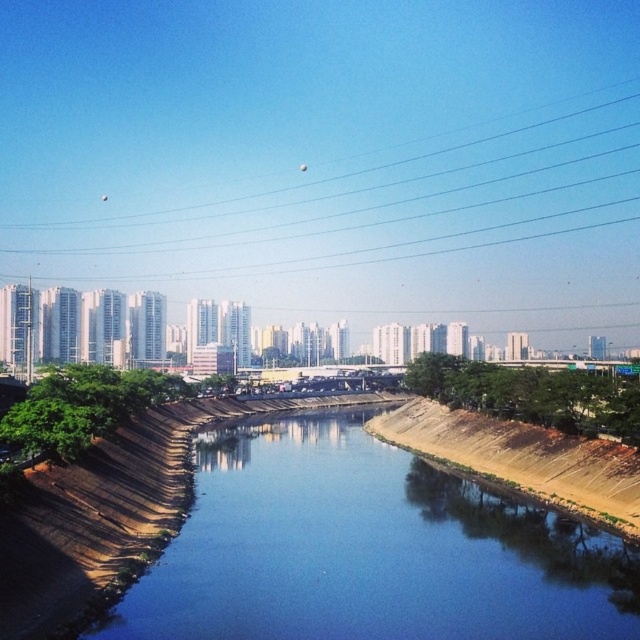
Is blue smooth water at center bigger than transparent glass power lines at upper center?

Actually, blue smooth water at center might be smaller than transparent glass power lines at upper center.

Does blue smooth water at center lie behind transparent glass power lines at upper center?

No, blue smooth water at center is in front of transparent glass power lines at upper center.

Who is more forward, (513,621) or (556,116)?

Positioned in front is point (513,621).

What are the coordinates of `blue smooth water at center` in the screenshot? It's located at coord(369,548).